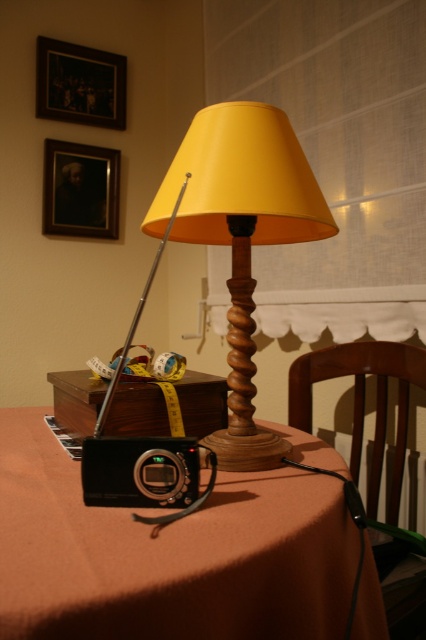
You are standing in the room and want to place a small decorative item exactly at the point marked by the coordinates point (241, 237). Which object from the scene will this point land on?

The point (241, 237) is on the yellow matte wood table lamp at center, so placing the item there would place it directly on the lamp.

You are standing in the room and want to place a new decorative item exactly at the center of the room. The yellow matte wood table lamp at center is currently at point 0.372, 0.566. Is the lamp already at the center of the room?

The yellow matte wood table lamp at center is positioned at point [241,237], which indicates it is located at the center of the room.